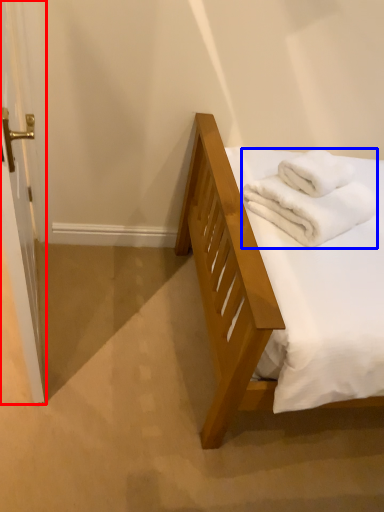
Question: Which of the following is the farthest to the observer, screen door (highlighted by a red box) or bath towel (highlighted by a blue box)?

Choices:
 (A) screen door
 (B) bath towel

Answer: (B)